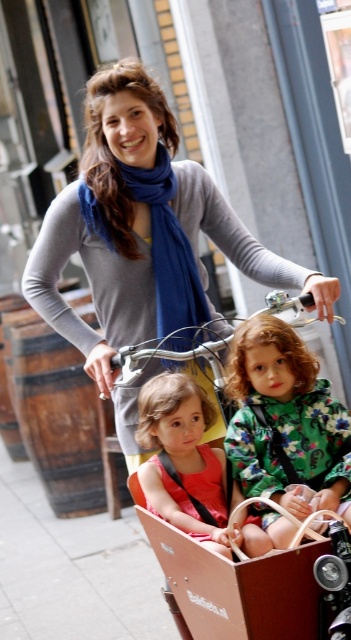
You are a photographer trying to capture a photo of the matte gray sweater at center and the matte pink dress at center. If you want to ensure both items are fully visible in the frame without any part being cut off, which object should you focus on first considering their widths?

The matte gray sweater at center is wider than the matte pink dress at center. Therefore, you should focus on the matte gray sweater at center first to ensure its entire width fits within the frame before adjusting for the narrower matte pink dress at center.